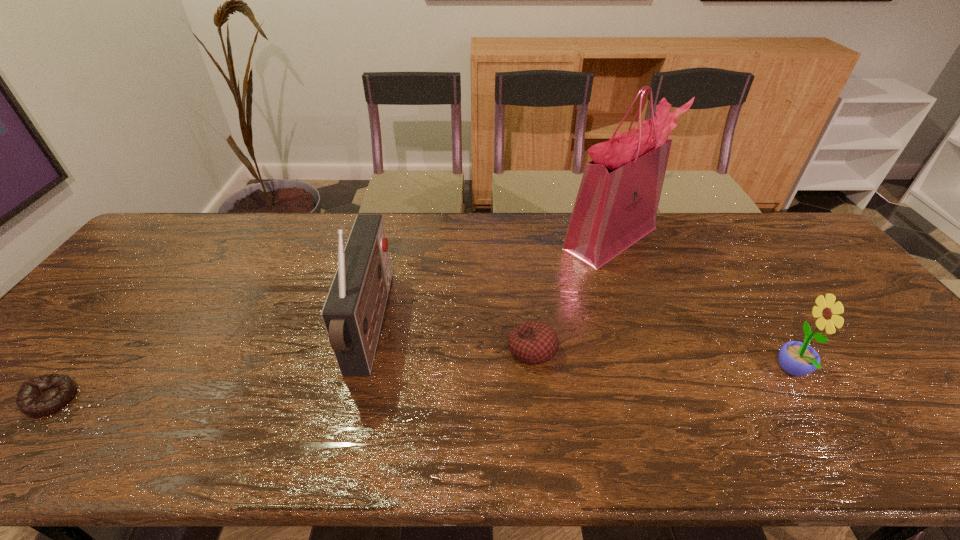
Find the location of a particular element. This screenshot has height=540, width=960. blank space located on the front of the farthest object is located at coordinates (635, 303).

You are a GUI agent. You are given a task and a screenshot of the screen. Output one action in this format:
    pyautogui.click(x=<x>, y=<y>)
    Task: Click on the vacant space located on the front panel of the radio receiver
    This screenshot has width=960, height=540.
    Given the screenshot: What is the action you would take?
    pyautogui.click(x=450, y=326)

Where is `vacant space located 0.180m on the front-facing side of the sunflower`? The image size is (960, 540). vacant space located 0.180m on the front-facing side of the sunflower is located at coordinates [701, 372].

The height and width of the screenshot is (540, 960). Identify the location of vacant area situated on the front-facing side of the sunflower. (742, 372).

Find the location of `blank space located 0.150m on the front-facing side of the sunflower`. blank space located 0.150m on the front-facing side of the sunflower is located at coordinates (713, 372).

Locate an element on the screen. free space located on the front of the second shortest object is located at coordinates (537, 391).

At what (x,y) coordinates should I click in order to perform the action: click on free region located 0.260m on the right of the shorter beanbag. Please return your answer as a coordinate pair (x, y). Image resolution: width=960 pixels, height=540 pixels. Looking at the image, I should click on (188, 399).

Find the location of a particular element. object located at the far edge is located at coordinates (617, 202).

In order to click on object that is at the left edge in this screenshot , I will do `click(41, 396)`.

At what (x,y) coordinates should I click in order to perform the action: click on free point at the far edge. Please return your answer as a coordinate pair (x, y). This screenshot has width=960, height=540. Looking at the image, I should click on (660, 238).